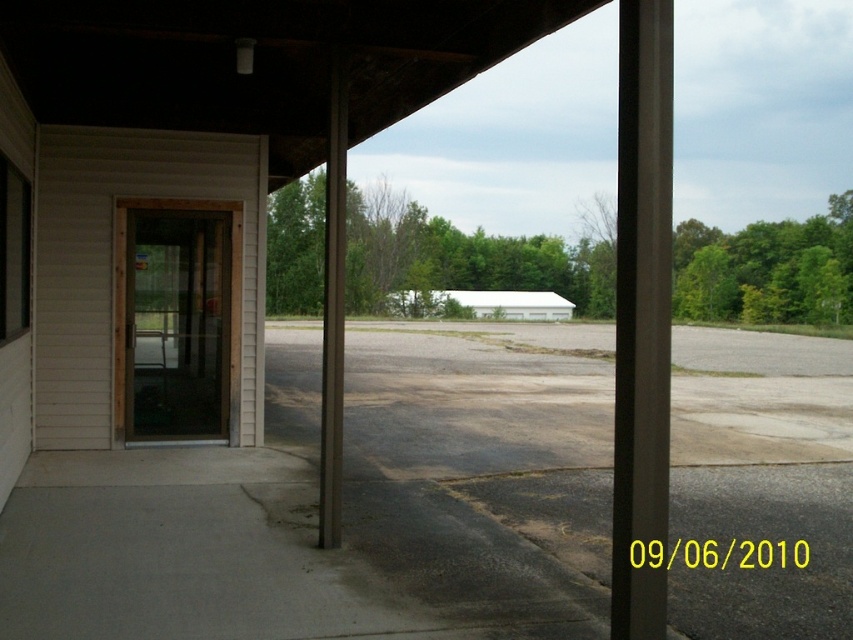
You are standing at the entrance of the covered area and notice a point marked at coordinates (641, 317). What object is located at that position?

The point at coordinates (641, 317) corresponds to the black smooth pole at center.

You are a delivery person trying to park your van in the parking lot. You notice two structures in the center of the lot. Which one is wider between the black smooth pole at center and the brown wood pillar at center?

The black smooth pole at center is wider than the brown wood pillar at center according to the description.